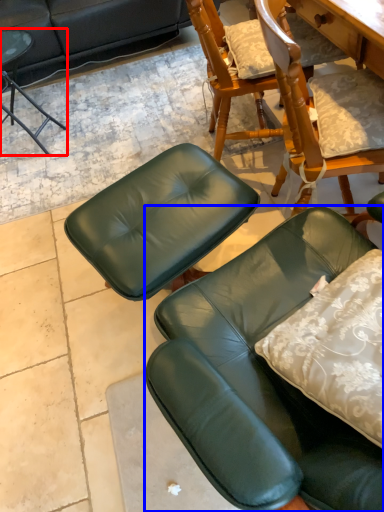
Question: Among these objects, which one is nearest to the camera, chair (highlighted by a red box) or chair (highlighted by a blue box)?

Choices:
 (A) chair
 (B) chair

Answer: (B)